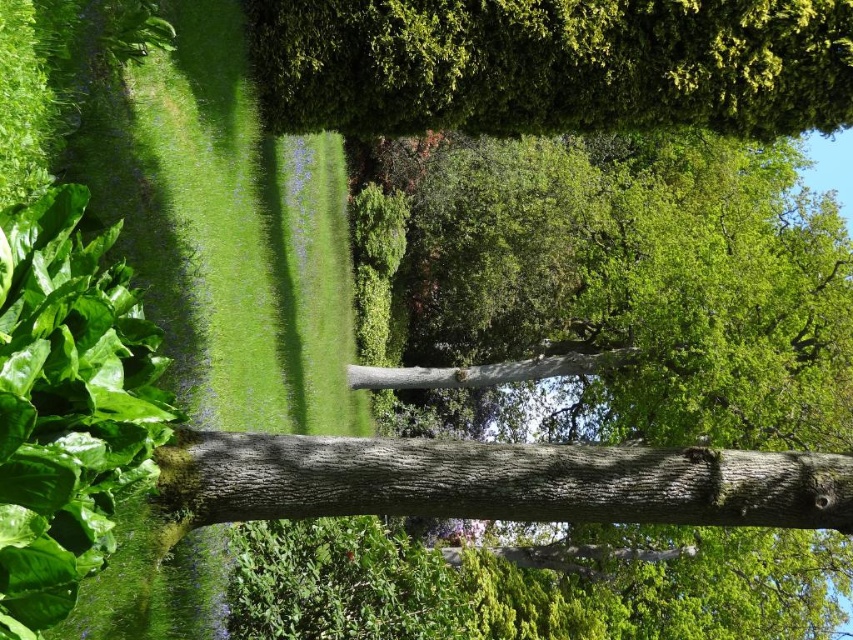
Does green leafy tree at upper center have a greater height compared to smooth brown tree trunk at center?

Yes.

Does point (848, 120) come closer to viewer compared to point (326, 493)?

That is False.

Is point (711, 13) positioned behind point (567, 490)?

Yes, it is behind point (567, 490).

The width and height of the screenshot is (853, 640). Identify the location of green leafy tree at upper center. (554, 65).